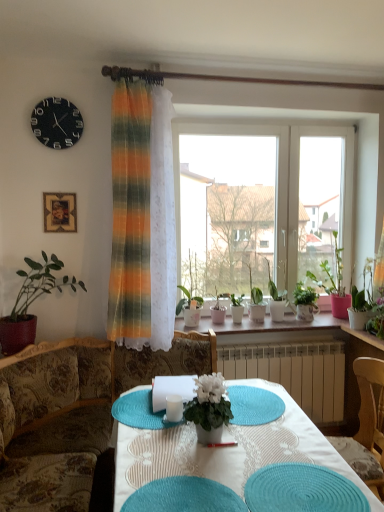
You are a GUI agent. You are given a task and a screenshot of the screen. Output one action in this format:
    pyautogui.click(x=<x>, y=<y>)
    Task: Click on the free space on the front side of white matte flower pot at center, arranged as the 1th houseplant when viewed from the front
    The width and height of the screenshot is (384, 512).
    Given the screenshot: What is the action you would take?
    pyautogui.click(x=216, y=460)